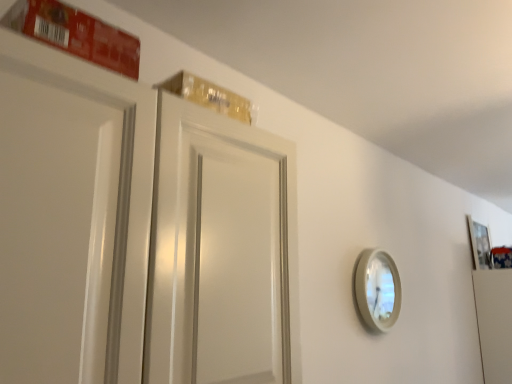
Question: Is white glossy mirror at right to the left of wooden picture frame at upper right from the viewer's perspective?

Choices:
 (A) no
 (B) yes

Answer: (B)

Question: Does white glossy mirror at right have a greater height compared to wooden picture frame at upper right?

Choices:
 (A) no
 (B) yes

Answer: (A)

Question: Is wooden picture frame at upper right located within white glossy mirror at right?

Choices:
 (A) yes
 (B) no

Answer: (B)

Question: Is the position of white glossy mirror at right more distant than that of wooden picture frame at upper right?

Choices:
 (A) yes
 (B) no

Answer: (B)

Question: From a real-world perspective, does white glossy mirror at right stand above wooden picture frame at upper right?

Choices:
 (A) yes
 (B) no

Answer: (B)

Question: Does white glossy mirror at right have a smaller size compared to wooden picture frame at upper right?

Choices:
 (A) no
 (B) yes

Answer: (B)

Question: From a real-world perspective, is wooden picture frame at upper right positioned over white glossy mirror at right based on gravity?

Choices:
 (A) no
 (B) yes

Answer: (B)

Question: Does wooden picture frame at upper right appear on the right side of white glossy mirror at right?

Choices:
 (A) no
 (B) yes

Answer: (B)

Question: From a real-world perspective, is wooden picture frame at upper right located beneath white glossy mirror at right?

Choices:
 (A) no
 (B) yes

Answer: (A)

Question: Does wooden picture frame at upper right have a lesser width compared to white glossy mirror at right?

Choices:
 (A) yes
 (B) no

Answer: (A)

Question: Does wooden picture frame at upper right touch white glossy mirror at right?

Choices:
 (A) no
 (B) yes

Answer: (A)

Question: Does wooden picture frame at upper right have a smaller size compared to white glossy mirror at right?

Choices:
 (A) no
 (B) yes

Answer: (A)

Question: From the image's perspective, is wooden picture frame at upper right located above or below white glossy mirror at right?

Choices:
 (A) above
 (B) below

Answer: (A)